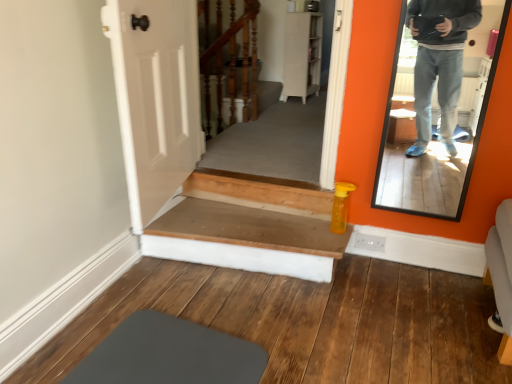
Question: Is matte black mirror at right not within wooden stairs at center?

Choices:
 (A) yes
 (B) no

Answer: (A)

Question: Is matte black mirror at right beside wooden stairs at center?

Choices:
 (A) no
 (B) yes

Answer: (A)

Question: Is matte black mirror at right oriented towards wooden stairs at center?

Choices:
 (A) no
 (B) yes

Answer: (A)

Question: Is matte black mirror at right to the right of wooden stairs at center from the viewer's perspective?

Choices:
 (A) no
 (B) yes

Answer: (B)

Question: Is matte black mirror at right not close to wooden stairs at center?

Choices:
 (A) no
 (B) yes

Answer: (B)

Question: From a real-world perspective, relative to wooden stairwell at center, is wooden stairs at center vertically above or below?

Choices:
 (A) above
 (B) below

Answer: (B)

Question: Considering their positions, is wooden stairs at center located in front of or behind wooden stairwell at center?

Choices:
 (A) front
 (B) behind

Answer: (A)

Question: Is wooden stairs at center to the left or to the right of wooden stairwell at center in the image?

Choices:
 (A) left
 (B) right

Answer: (B)

Question: Considering the positions of wooden stairs at center and wooden stairwell at center in the image, is wooden stairs at center wider or thinner than wooden stairwell at center?

Choices:
 (A) thin
 (B) wide

Answer: (B)

Question: In terms of width, does wooden stairwell at center look wider or thinner when compared to wooden stairs at center?

Choices:
 (A) thin
 (B) wide

Answer: (A)

Question: Is point (205, 4) positioned closer to the camera than point (241, 206)?

Choices:
 (A) closer
 (B) farther

Answer: (B)

Question: From their relative heights in the image, would you say wooden stairwell at center is taller or shorter than wooden stairs at center?

Choices:
 (A) short
 (B) tall

Answer: (B)

Question: Considering the positions of wooden stairwell at center and wooden stairs at center in the image, is wooden stairwell at center bigger or smaller than wooden stairs at center?

Choices:
 (A) big
 (B) small

Answer: (A)

Question: Considering their positions, is wooden stairs at center located in front of or behind matte black mirror at right?

Choices:
 (A) front
 (B) behind

Answer: (B)

Question: Do you think wooden stairs at center is within matte black mirror at right, or outside of it?

Choices:
 (A) outside
 (B) inside

Answer: (A)